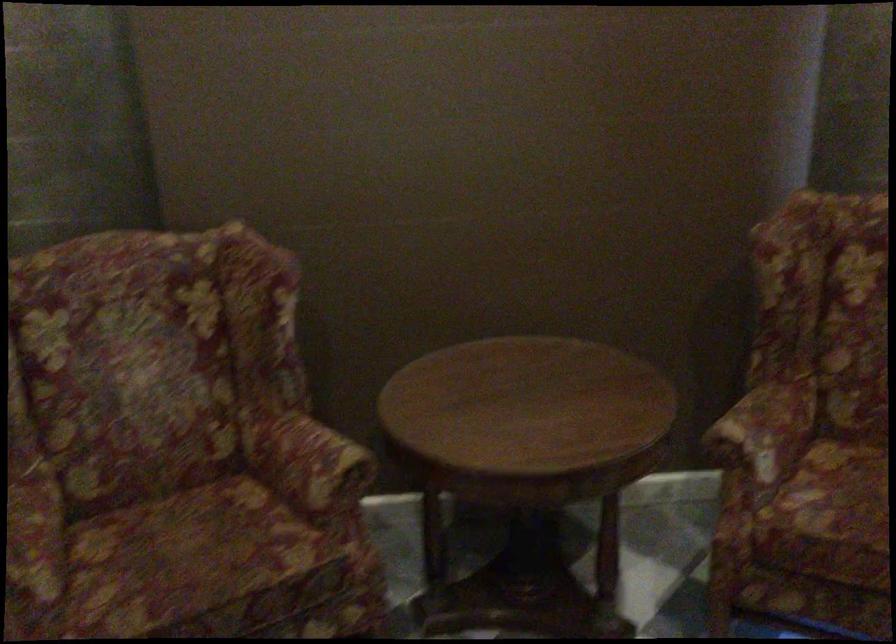
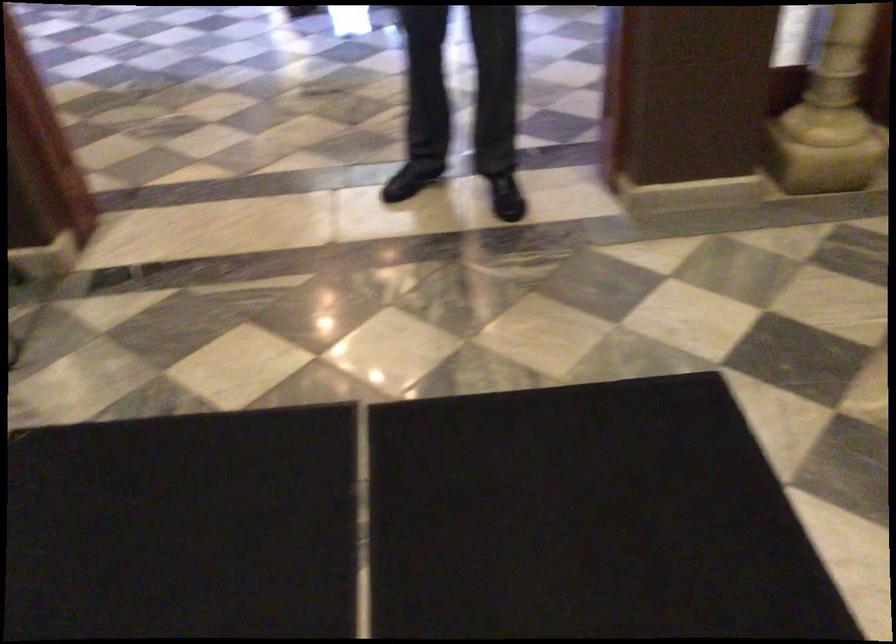
How did the camera likely rotate?

The camera's rotation is toward left-down.